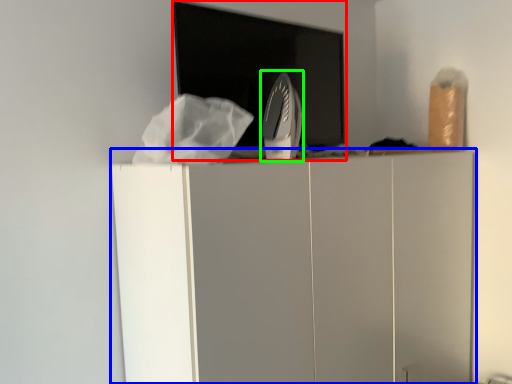
Question: Based on their relative distances, which object is farther from appliance (highlighted by a red box)? Choose from furniture (highlighted by a blue box) and home appliance (highlighted by a green box).

Choices:
 (A) furniture
 (B) home appliance

Answer: (A)